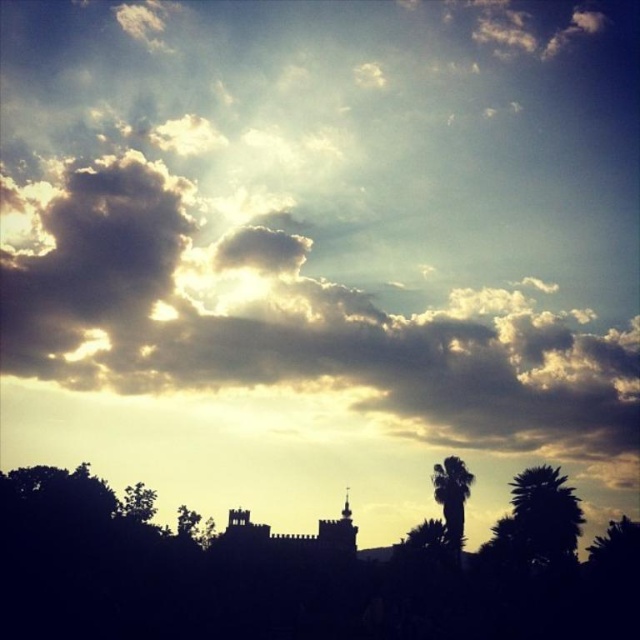
Question: Is green leafy palm tree at right positioned in front of green leafy palm tree at center-right?

Choices:
 (A) yes
 (B) no

Answer: (A)

Question: Is green leafy palm tree at right to the left of green leafy palm tree at center-right from the viewer's perspective?

Choices:
 (A) no
 (B) yes

Answer: (A)

Question: Which point is farther to the camera?

Choices:
 (A) green leafy palm tree at center-right
 (B) green leafy palm tree at right

Answer: (A)

Question: Can you confirm if green leafy palm tree at right is positioned below green leafy palm tree at center-right?

Choices:
 (A) yes
 (B) no

Answer: (A)